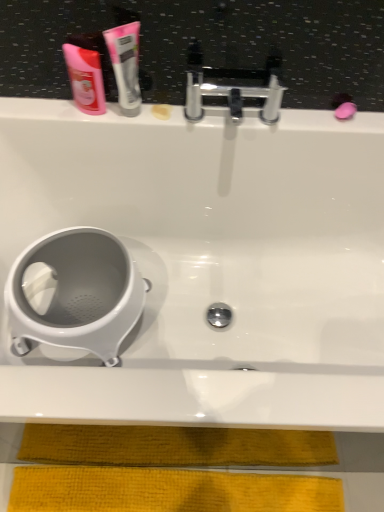
The height and width of the screenshot is (512, 384). I want to click on vacant region to the left of white glossy tube at upper center, so click(x=72, y=115).